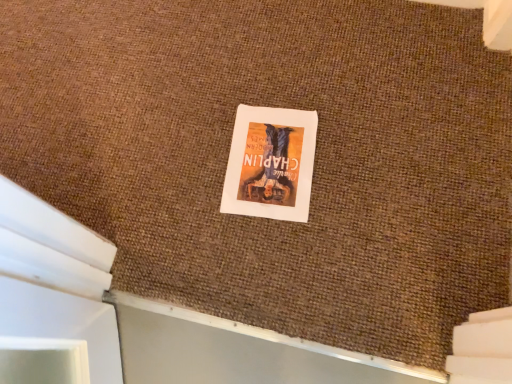
At what (x,y) coordinates should I click in order to perform the action: click on spots to the right of matte paper poster at center. Please return your answer as a coordinate pair (x, y). This screenshot has height=384, width=512. Looking at the image, I should click on (366, 147).